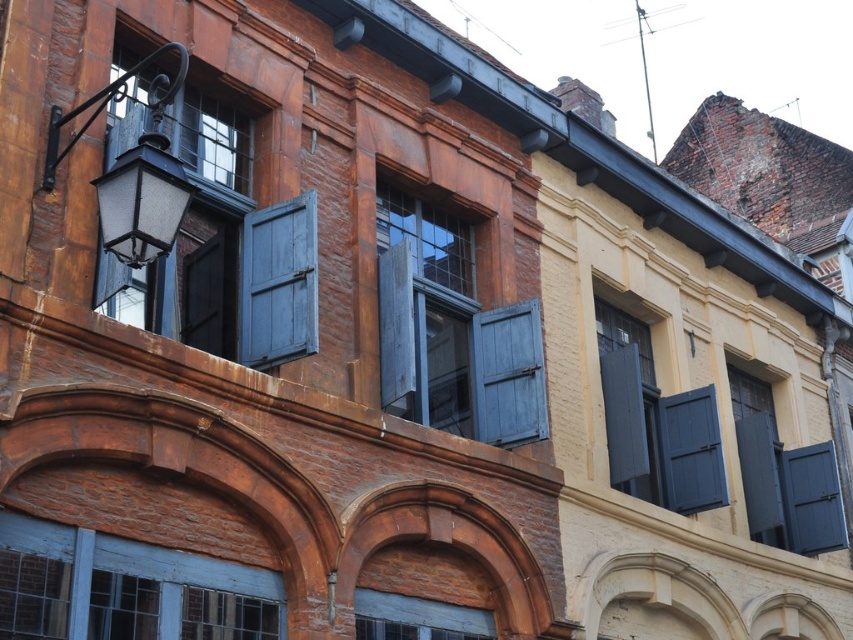
Question: Which of the following is the closest to the observer?

Choices:
 (A) (682, 408)
 (B) (480, 429)
 (C) (380, 252)
 (D) (440, 340)

Answer: (C)

Question: Estimate the real-world distances between objects in this image. Which object is closer to the blue painted wood window at lower left?

Choices:
 (A) matte gray wooden window at center
 (B) matte dark blue shutter at center right
 (C) wooden at center

Answer: (C)

Question: Which point appears closest to the camera in this image?

Choices:
 (A) (308, 228)
 (B) (476, 376)
 (C) (148, 557)
 (D) (669, 417)

Answer: (C)

Question: Is blue painted wood shutter at center bigger than wooden blue shutter at center?

Choices:
 (A) yes
 (B) no

Answer: (A)

Question: From the image, what is the correct spatial relationship of matte gray wood shutter at center in relation to matte gray wooden window at center?

Choices:
 (A) below
 (B) above

Answer: (B)

Question: Does matte black lantern at upper left appear under matte gray wooden window at center?

Choices:
 (A) yes
 (B) no

Answer: (B)